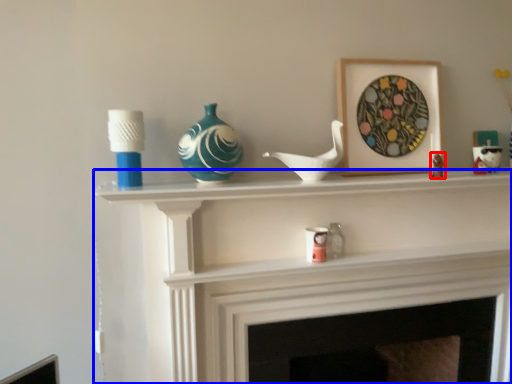
Question: Which object is further to the camera taking this photo, toy (highlighted by a red box) or shelf (highlighted by a blue box)?

Choices:
 (A) toy
 (B) shelf

Answer: (A)